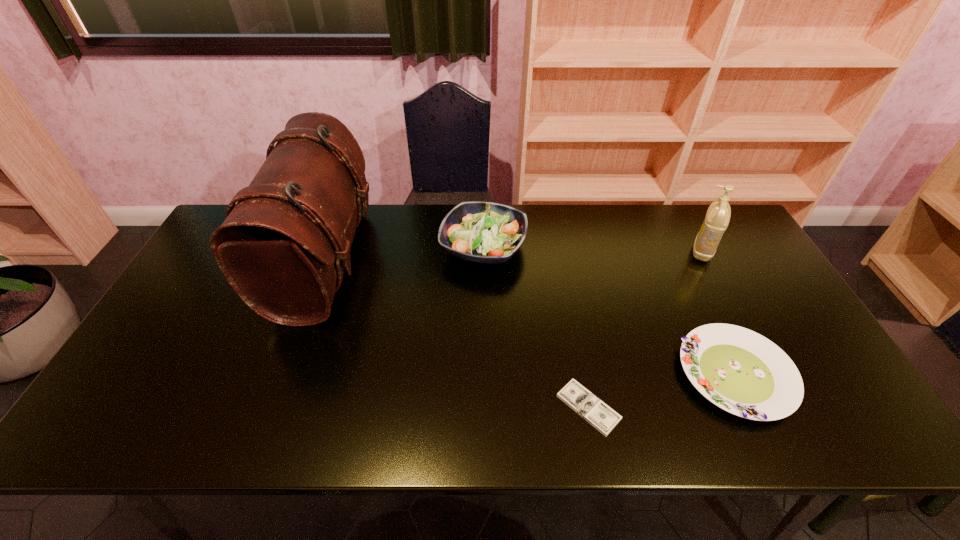
Identify the location of vacant space that satisfies the following two spatial constraints: 1. on the front-facing side of the dollar; 2. on the right side of the leftmost object. This screenshot has width=960, height=540. (272, 407).

Locate an element on the screen. free space in the image that satisfies the following two spatial constraints: 1. on the front-facing side of the leftmost object; 2. on the left side of the second shortest object is located at coordinates (283, 375).

Where is `free space that satisfies the following two spatial constraints: 1. on the front-facing side of the third object from right to left; 2. on the right side of the satchel`? free space that satisfies the following two spatial constraints: 1. on the front-facing side of the third object from right to left; 2. on the right side of the satchel is located at coordinates (272, 407).